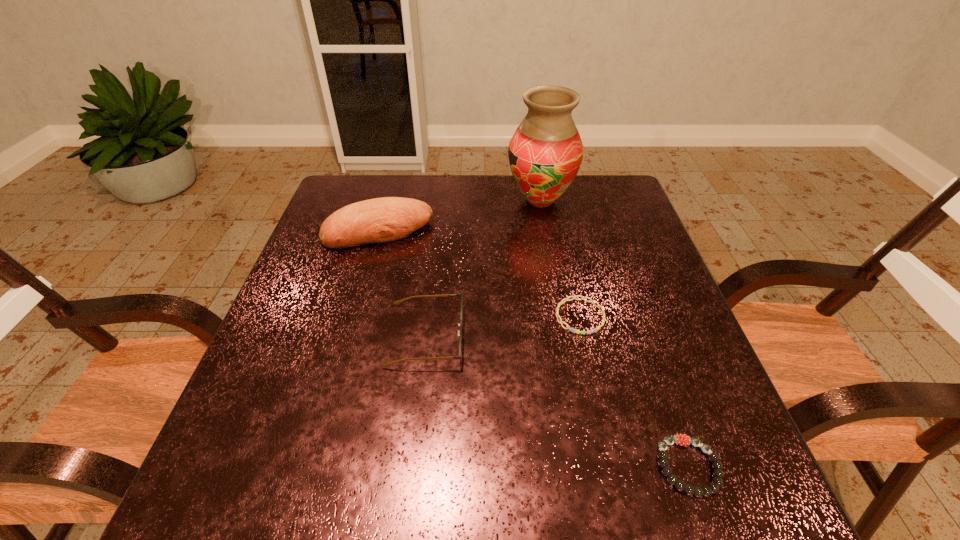
You are a GUI agent. You are given a task and a screenshot of the screen. Output one action in this format:
    pyautogui.click(x=<x>, y=<y>)
    Task: Click on the vase
    
    Given the screenshot: What is the action you would take?
    pyautogui.click(x=545, y=153)

Locate an element on the screen. This screenshot has height=540, width=960. bread is located at coordinates (386, 219).

This screenshot has height=540, width=960. Identify the location of the third shortest object. (461, 294).

The image size is (960, 540). What are the coordinates of `the right bracelet` in the screenshot? It's located at (682, 439).

The width and height of the screenshot is (960, 540). I want to click on the rightmost object, so click(682, 439).

Locate an element on the screen. The width and height of the screenshot is (960, 540). the left bracelet is located at coordinates (561, 322).

The height and width of the screenshot is (540, 960). Identify the location of vacant space located 0.250m on the front of the tallest object. (555, 281).

The height and width of the screenshot is (540, 960). I want to click on blank space located 0.240m on the front of the bread, so pyautogui.click(x=353, y=320).

Find the location of `blank space located on the front-facing side of the third shortest object`. blank space located on the front-facing side of the third shortest object is located at coordinates (486, 335).

Find the location of `vacant area located 0.310m on the back of the nearer bracelet`. vacant area located 0.310m on the back of the nearer bracelet is located at coordinates point(634,308).